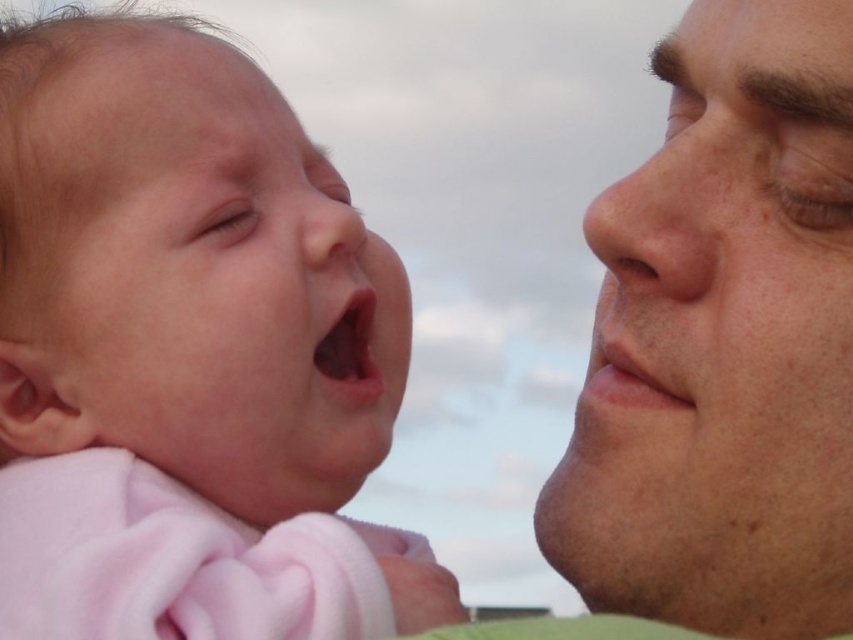
Can you confirm if pink soft fabric baby at left is smaller than smooth flesh nose at center?

Incorrect, pink soft fabric baby at left is not smaller in size than smooth flesh nose at center.

How much distance is there between pink soft fabric baby at left and smooth flesh nose at center?

A distance of 8.47 inches exists between pink soft fabric baby at left and smooth flesh nose at center.

Who is more distant from viewer, (44, 179) or (339, 188)?

Positioned behind is point (339, 188).

Image resolution: width=853 pixels, height=640 pixels. Find the location of `pink soft fabric baby at left`. pink soft fabric baby at left is located at coordinates (184, 356).

Does point (755, 627) lie behind point (306, 253)?

No.

Consider the image. Between smooth skin face at right and smooth flesh nose at center, which one is positioned lower?

smooth skin face at right is lower down.

Does point (648, 426) come in front of point (317, 204)?

Yes, point (648, 426) is in front of point (317, 204).

The image size is (853, 640). I want to click on smooth skin face at right, so click(x=723, y=342).

Can you confirm if pink soft fabric baby at left is bigger than smooth skin face at right?

Yes.

You are a GUI agent. You are given a task and a screenshot of the screen. Output one action in this format:
    pyautogui.click(x=<x>, y=<y>)
    Task: Click on the pink soft fabric baby at left
    Image resolution: width=853 pixels, height=640 pixels.
    Given the screenshot: What is the action you would take?
    pyautogui.click(x=184, y=356)